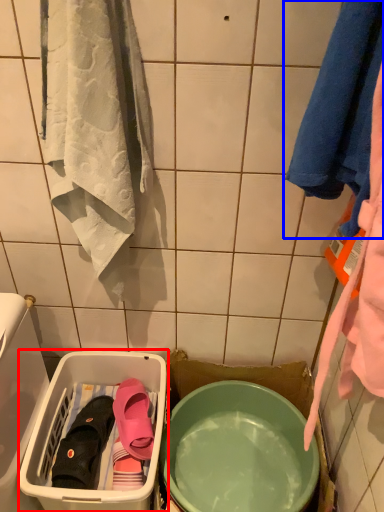
Question: Which point is closer to the camera, laundry basket (highlighted by a red box) or towel (highlighted by a blue box)?

Choices:
 (A) laundry basket
 (B) towel

Answer: (B)